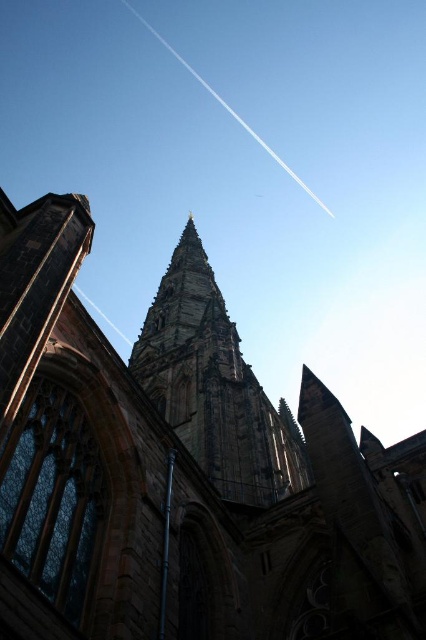
Can you confirm if dark gray stone church steeple at center is thinner than dark gray stone tower at center?

No, dark gray stone church steeple at center is not thinner than dark gray stone tower at center.

The height and width of the screenshot is (640, 426). What are the coordinates of `dark gray stone church steeple at center` in the screenshot? It's located at (183, 470).